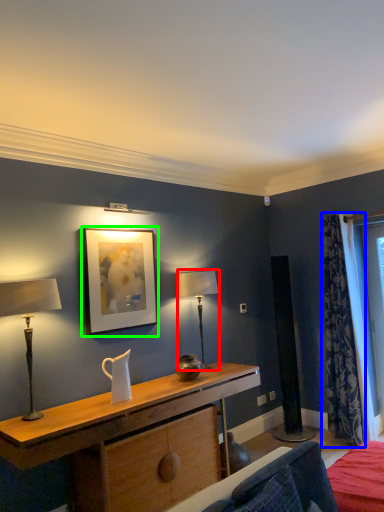
Question: Which is nearer to the table lamp (highlighted by a red box)? curtain (highlighted by a blue box) or picture frame (highlighted by a green box).

Choices:
 (A) curtain
 (B) picture frame

Answer: (B)